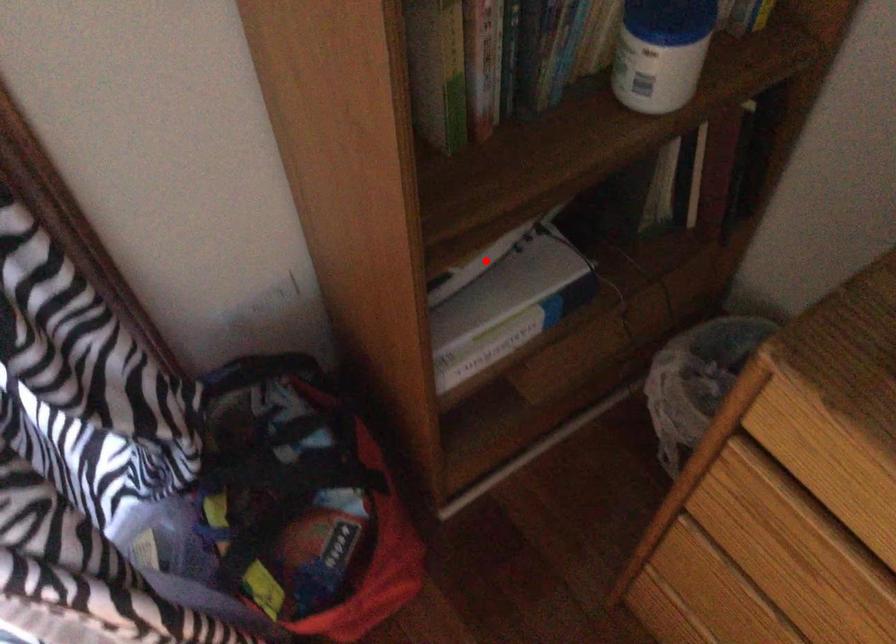
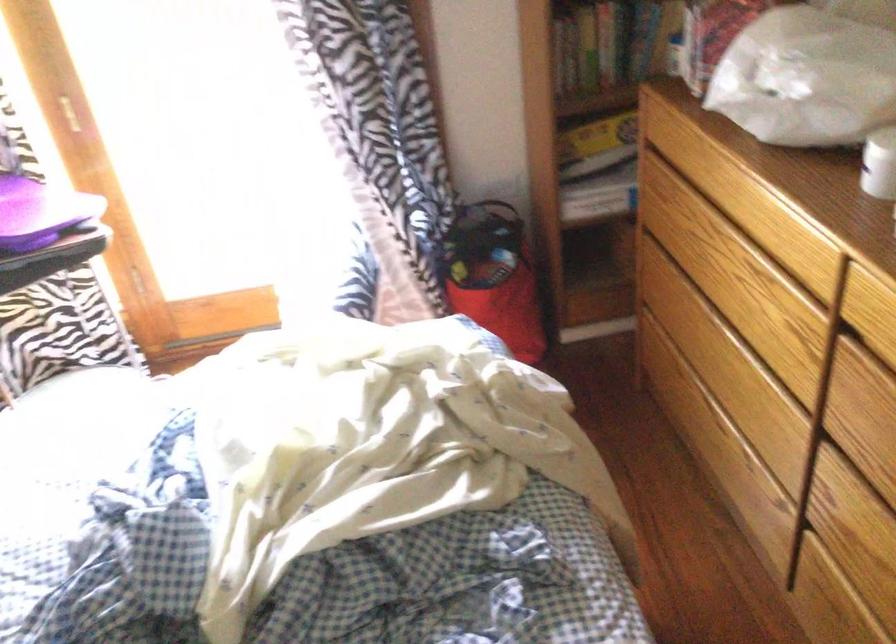
Question: I am providing you with two images of the same scene from different viewpoints. Image1 has a red point marked. In image2, the corresponding 3D location appears at what relative position? Reply with the corresponding letter.

Choices:
 (A) Closer
 (B) Farther

Answer: (B)